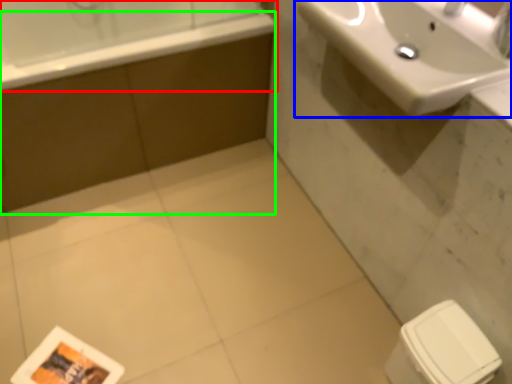
Question: Which object is positioned closest to bathtub (highlighted by a red box)? Select from sink (highlighted by a blue box) and bath (highlighted by a green box).

Choices:
 (A) sink
 (B) bath

Answer: (B)